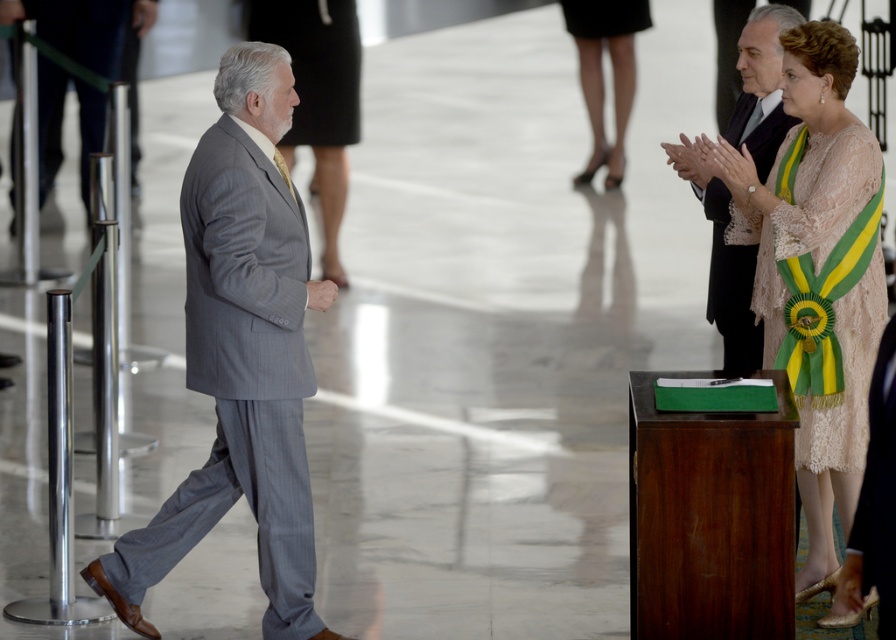
Can you confirm if lace dress at right is thinner than white lace dress at center?

Yes.

Is point (837, 461) positioned in front of point (342, 125)?

Yes, it is in front of point (342, 125).

Is point (817, 465) in front of point (264, 19)?

Yes, it is.

Identify the location of lace dress at right. This screenshot has height=640, width=896. (816, 273).

In the scene shown: Does black satin suit at right appear on the right side of white lace dress at center?

Correct, you'll find black satin suit at right to the right of white lace dress at center.

Does black satin suit at right have a greater width compared to white lace dress at center?

No.

Find the location of a particular element. Image resolution: width=896 pixels, height=640 pixels. black satin suit at right is located at coordinates (722, 264).

Find the location of a particular element. black satin suit at right is located at coordinates (722, 264).

Which is below, gray pinstripe suit at left or white lace dress at center?

gray pinstripe suit at left is below.

Does gray pinstripe suit at left appear on the right side of white lace dress at center?

Correct, you'll find gray pinstripe suit at left to the right of white lace dress at center.

Which is in front, point (273, 380) or point (329, 28)?

Point (273, 380) is in front.

At what (x,y) coordinates should I click in order to perform the action: click on gray pinstripe suit at left. Please return your answer as a coordinate pair (x, y). Image resolution: width=896 pixels, height=640 pixels. Looking at the image, I should click on (240, 355).